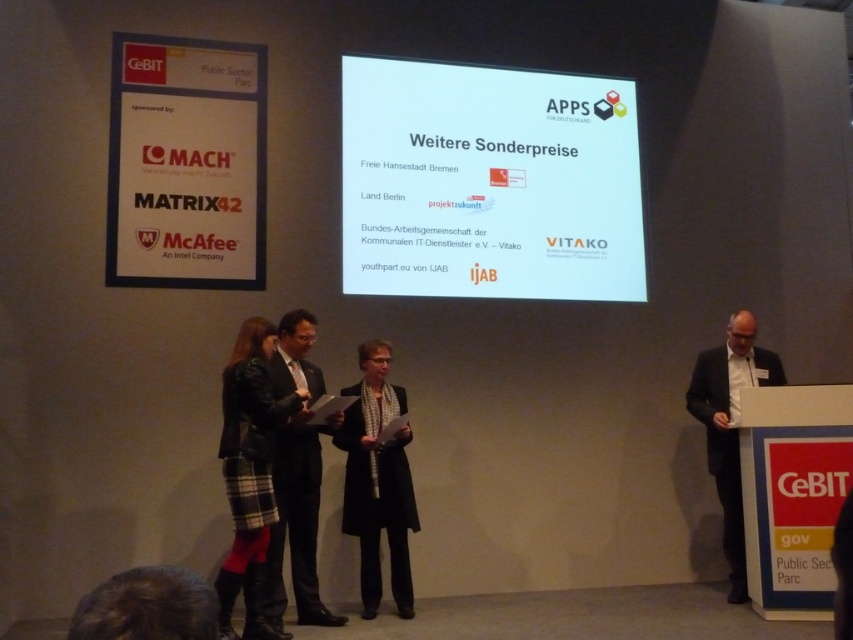
You are an event photographer at the conference. You need to capture a photo of the two individuals at the center of the stage. The plaid fabric skirt at center and the dark suit at center. From which side should you position yourself to ensure both are fully visible in the frame?

You should position yourself to the right of the stage because the plaid fabric skirt at center is to the left of the dark suit at center, so positioning yourself on the right side will allow you to capture both individuals in the frame without any obstruction.

Looking at this image, you are an event organizer who needs to ensure that all participants are visible to the audience. Given that the plaid fabric skirt at center and dark suit at center are both at the center, which one is shorter and might require a microphone stand adjustment?

The plaid fabric skirt at center is not as tall as dark suit at center, so the plaid fabric skirt at center is shorter and might require a microphone stand adjustment.

You are organizing a presentation and need to decide whether the black wool coat at center can fit on the white glossy projection screen at center. Based on their sizes, can the coat be placed entirely on the screen without overlapping the edges?

The white glossy projection screen at center is wider than the black wool coat at center, so yes, the coat can be placed entirely on the screen without overlapping the edges.